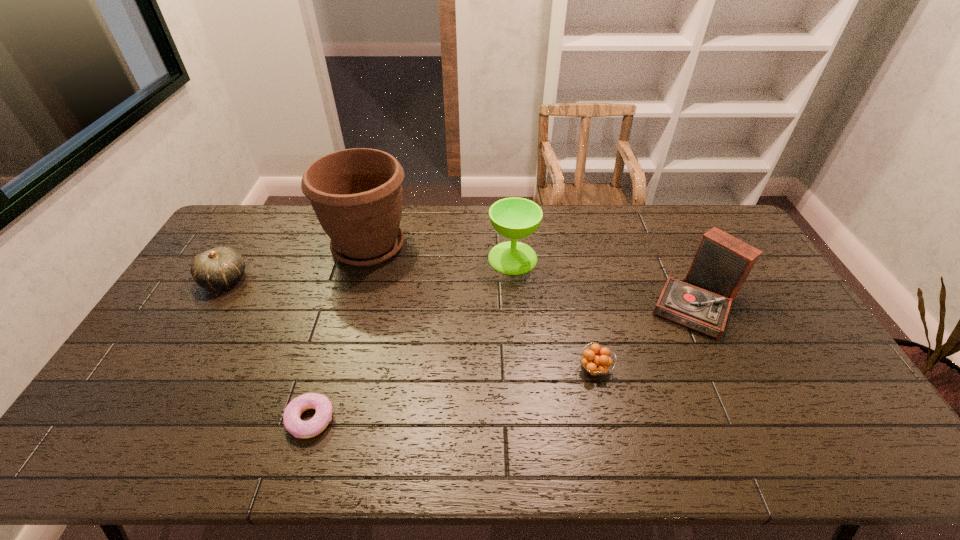
Where is `flowerpot`? This screenshot has width=960, height=540. flowerpot is located at coordinates (356, 194).

The width and height of the screenshot is (960, 540). I want to click on wineglass, so click(515, 218).

Locate an element on the screen. This screenshot has height=540, width=960. phonograph record is located at coordinates (722, 263).

The width and height of the screenshot is (960, 540). Identify the location of the fourth tallest object. (220, 267).

The image size is (960, 540). I want to click on the leftmost object, so click(x=220, y=267).

You are a GUI agent. You are given a task and a screenshot of the screen. Output one action in this format:
    pyautogui.click(x=<x>, y=<y>)
    Task: Click on the second shortest object
    
    Given the screenshot: What is the action you would take?
    pyautogui.click(x=596, y=361)

The height and width of the screenshot is (540, 960). I want to click on the fifth object from left to right, so click(x=596, y=361).

Image resolution: width=960 pixels, height=540 pixels. In order to click on doughnut in this screenshot , I will do `click(293, 424)`.

This screenshot has height=540, width=960. What are the coordinates of `the nearest object` in the screenshot? It's located at (293, 424).

The height and width of the screenshot is (540, 960). Identify the location of vacant space located on the right of the flowerpot. (516, 246).